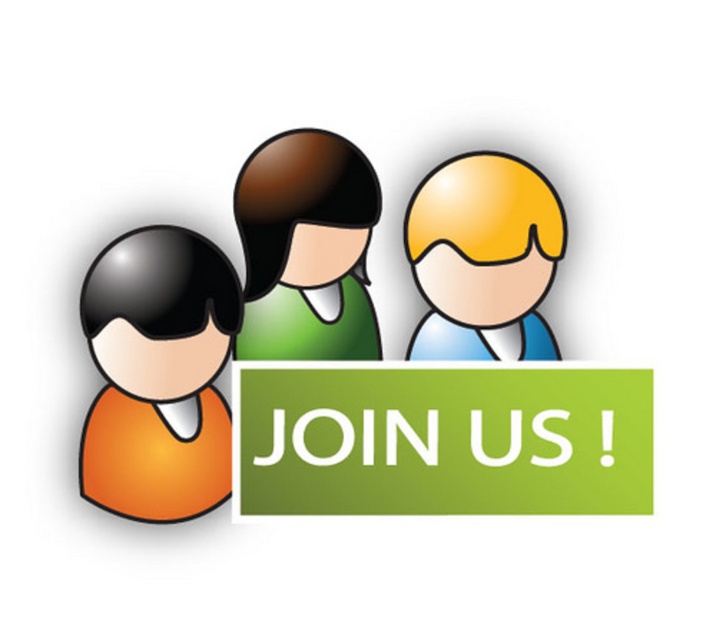
Can you confirm if matte green shirt at center is thinner than green matte sign at center?

In fact, matte green shirt at center might be wider than green matte sign at center.

Where is `matte green shirt at center`? Image resolution: width=716 pixels, height=640 pixels. matte green shirt at center is located at coordinates (226, 324).

At what (x,y) coordinates should I click in order to perform the action: click on matte green shirt at center. Please return your answer as a coordinate pair (x, y). Looking at the image, I should click on (226, 324).

Is point (218, 429) behind point (329, 220)?

No, it is not.

Looking at this image, which is below, orange matte head at left or green matte shirt at center?

orange matte head at left is lower down.

At what (x,y) coordinates should I click in order to perform the action: click on orange matte head at left. Please return your answer as a coordinate pair (x, y). This screenshot has height=640, width=716. Looking at the image, I should click on (158, 372).

Which is below, green matte sign at center or orange matte head at left?

green matte sign at center

Where is `green matte sign at center`? This screenshot has height=640, width=716. green matte sign at center is located at coordinates (445, 440).